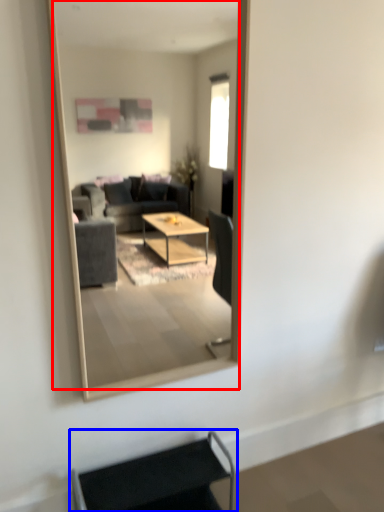
Question: Which object appears farthest to the camera in this image, mirror (highlighted by a red box) or armchair (highlighted by a blue box)?

Choices:
 (A) mirror
 (B) armchair

Answer: (B)